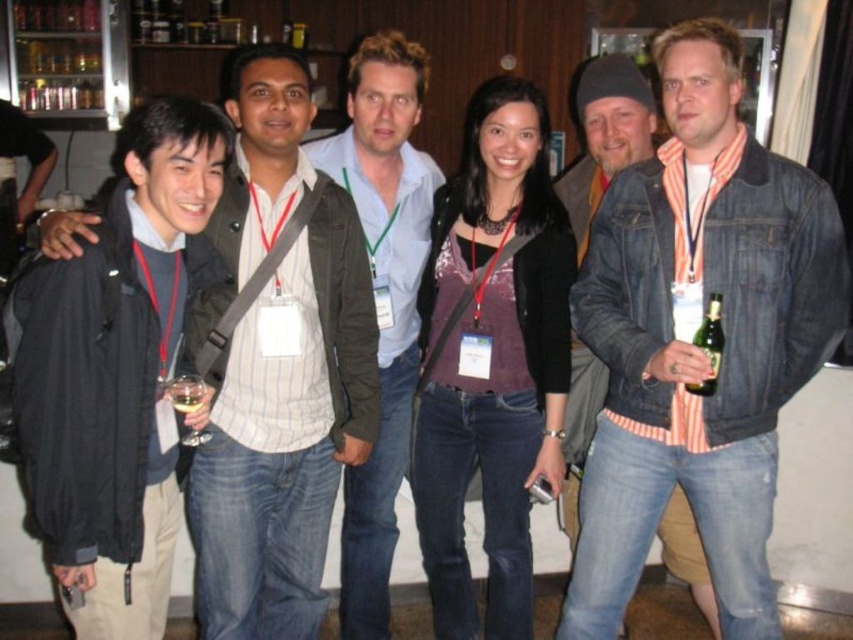
Question: In this image, where is denim jacket at right located relative to light brown leather jacket at center?

Choices:
 (A) above
 (B) below

Answer: (B)

Question: From the image, what is the correct spatial relationship of denim jacket at right in relation to green glass bottle at right?

Choices:
 (A) below
 (B) above

Answer: (A)

Question: Which of the following is the farthest from the observer?

Choices:
 (A) (364, 333)
 (B) (199, 392)
 (C) (621, 184)
 (D) (198, 392)

Answer: (A)

Question: Does denim jacket at right have a larger size compared to green glass bottle at right?

Choices:
 (A) no
 (B) yes

Answer: (B)

Question: Which is nearer to the clear glass wine glass at left?

Choices:
 (A) light brown leather jacket at center
 (B) matte black jacket at left

Answer: (B)

Question: Which point appears closest to the camera in this image?

Choices:
 (A) (192, 404)
 (B) (129, 234)
 (C) (190, 476)
 (D) (837, 289)

Answer: (B)